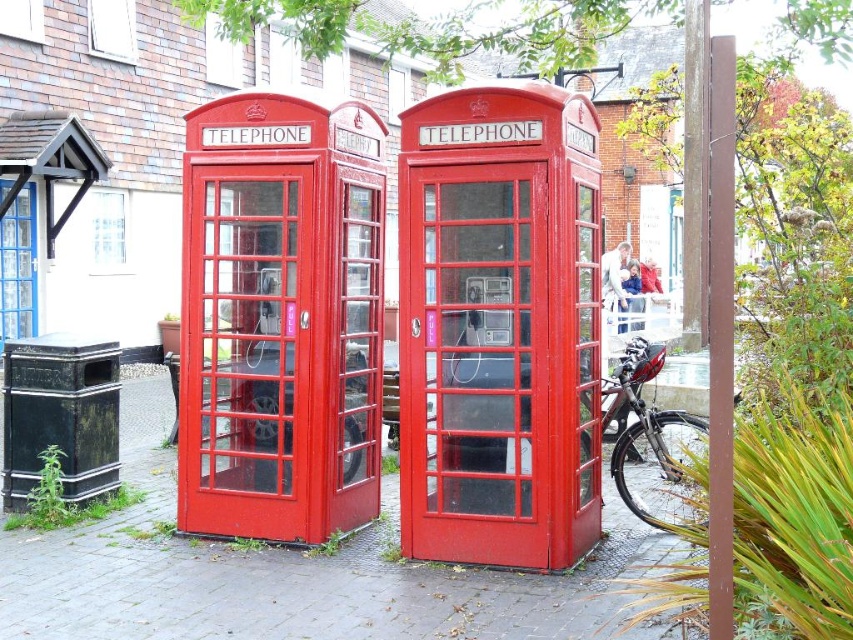
Question: Does shiny black bicycle at center appear over matte glass telephone booth at center?

Choices:
 (A) no
 (B) yes

Answer: (A)

Question: Which point appears farthest from the camera in this image?

Choices:
 (A) (467, 300)
 (B) (659, 342)

Answer: (B)

Question: In this image, where is shiny black bicycle at center located relative to matte glass telephone booth at center?

Choices:
 (A) left
 (B) right

Answer: (B)

Question: Which object appears farthest from the camera in this image?

Choices:
 (A) shiny black bicycle at center
 (B) matte glass telephone booth at center

Answer: (A)

Question: Does shiny black bicycle at center have a lesser width compared to matte glass telephone booth at center?

Choices:
 (A) no
 (B) yes

Answer: (A)

Question: Which point is closer to the camera?

Choices:
 (A) (502, 300)
 (B) (614, 376)

Answer: (A)